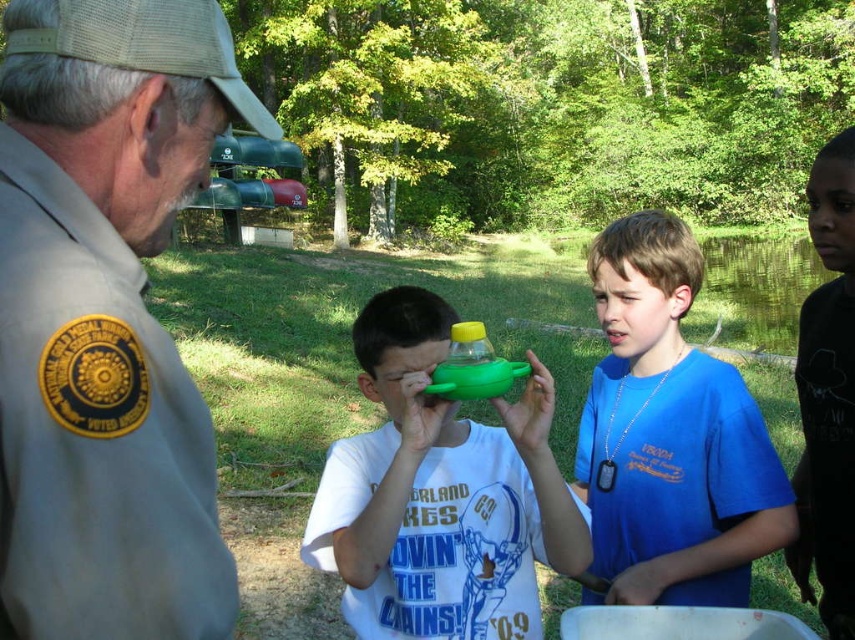
Question: Which is farther from the blue cotton shirt at center?

Choices:
 (A) green matte toy at center
 (B) tan uniform at left

Answer: (B)

Question: Which of the following is the farthest from the observer?

Choices:
 (A) (646, 369)
 (B) (38, 289)
 (C) (401, 294)

Answer: (A)

Question: Can you confirm if tan uniform at left is thinner than blue cotton shirt at center?

Choices:
 (A) yes
 (B) no

Answer: (A)

Question: Among these objects, which one is nearest to the camera?

Choices:
 (A) tan uniform at left
 (B) green matte toy at center

Answer: (A)

Question: Can you confirm if green matte toy at center is bigger than blue cotton shirt at center?

Choices:
 (A) no
 (B) yes

Answer: (B)

Question: Is green matte toy at center smaller than blue cotton shirt at center?

Choices:
 (A) no
 (B) yes

Answer: (A)